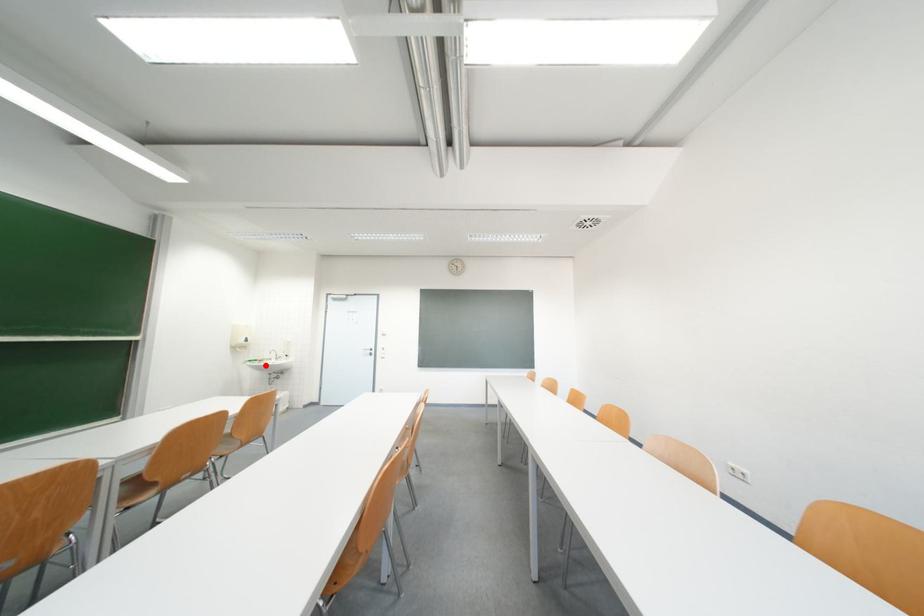
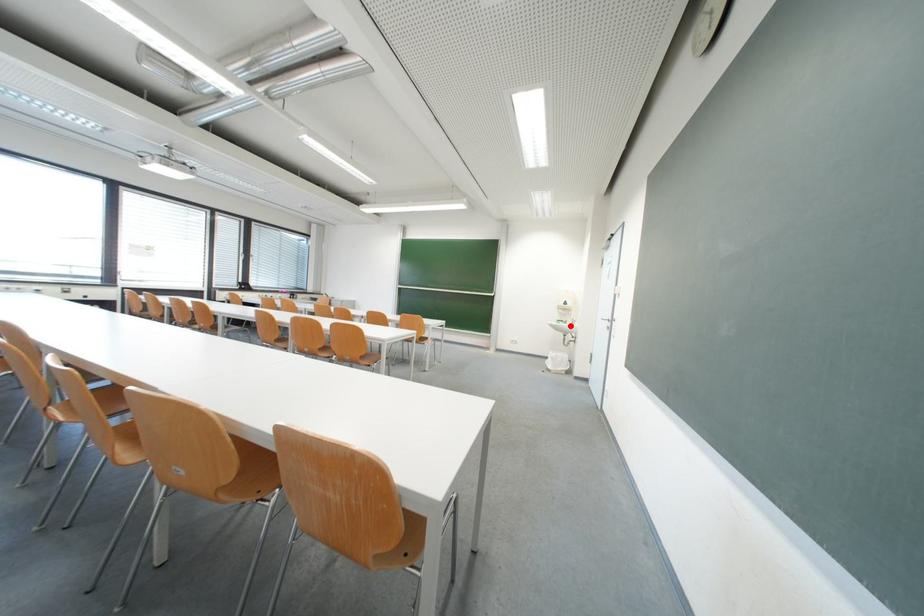
I am providing you with two images of the same scene from different viewpoints. A red point is marked on the first image and another point is marked on the second image. Are the points marked in image1 and image2 representing the same 3D position?

Yes